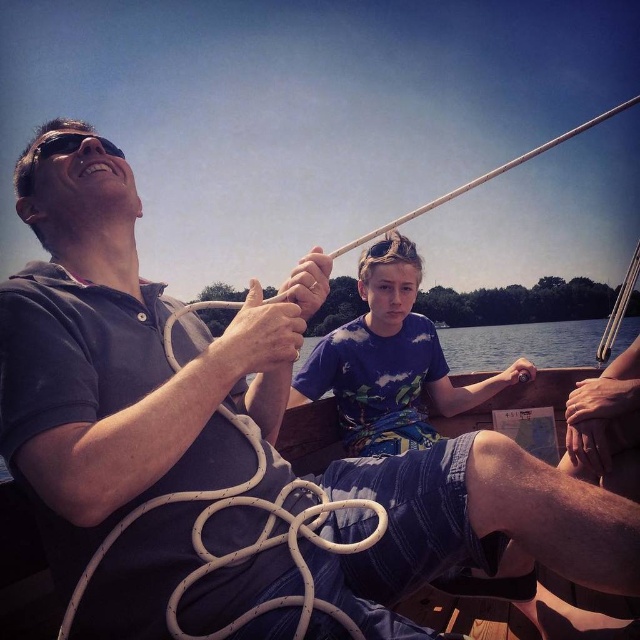
Question: Which of the following is the farthest from the observer?

Choices:
 (A) (348, 417)
 (B) (67, 150)
 (C) (109, 529)

Answer: (A)

Question: Does blue printed shirt at center lie behind white matte rope at center?

Choices:
 (A) yes
 (B) no

Answer: (A)

Question: Based on their relative distances, which object is nearer to the blue printed shirt at center?

Choices:
 (A) black matte sunglasses at upper left
 (B) white matte rope at center

Answer: (B)

Question: Is blue printed shirt at center smaller than white matte rope at center?

Choices:
 (A) no
 (B) yes

Answer: (A)

Question: Which of the following is the farthest from the observer?

Choices:
 (A) (227, 554)
 (B) (368, 440)

Answer: (B)

Question: Is blue printed shirt at center wider than black matte sunglasses at upper left?

Choices:
 (A) no
 (B) yes

Answer: (A)